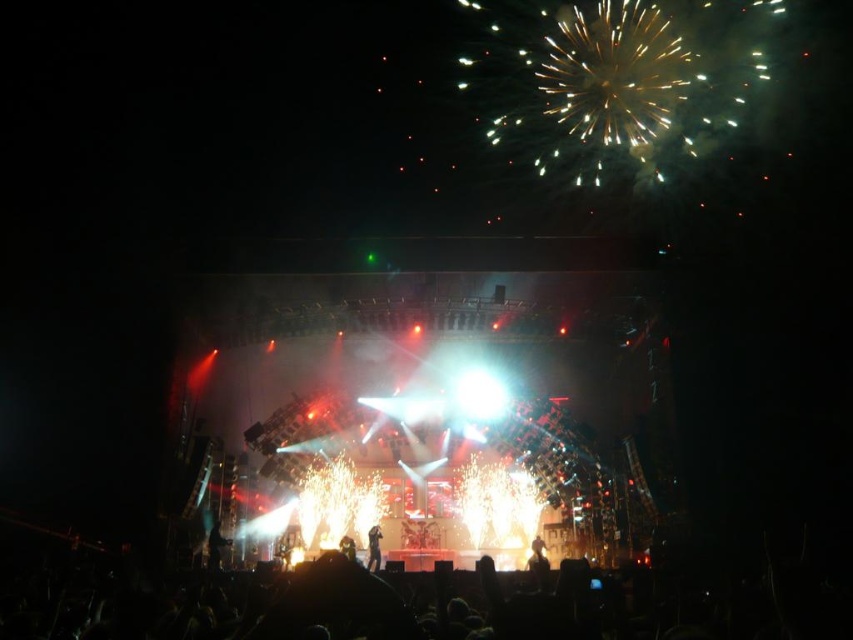
You are standing at the point where the viewer is located in the concert scene. There is a specific point marked at coordinates point [155,596]. If you want to move closer to that point, which direction should you move in relation to your current position?

The point [155,596] is 381.41 feet away from the viewer. To move closer to it, you should move forward towards the stage since the point is likely located on the stage area given the concert scene description.

You are a photographer at the concert trying to capture a photo of the fireworks. You have two points marked on your camera screen to focus on. The first point is at point (157, 618) and the second point is at point (537, 541). Which point should you focus on to ensure the fireworks in the sky are in focus?

You should focus on point (537, 541) because it is further away from the camera than point (157, 618), and fireworks are in the sky which is further back.